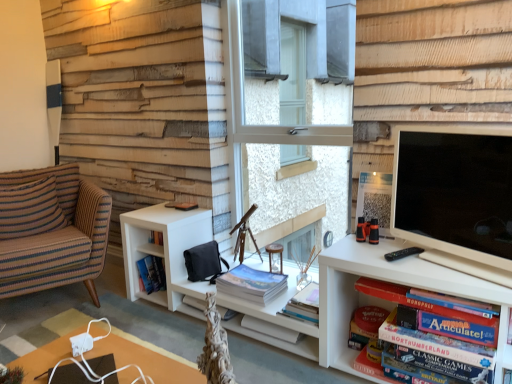
Question: Is striped fabric pillow at left to the right of matte white tv at right from the viewer's perspective?

Choices:
 (A) no
 (B) yes

Answer: (A)

Question: From a real-world perspective, is striped fabric pillow at left below matte white tv at right?

Choices:
 (A) no
 (B) yes

Answer: (B)

Question: Could you tell me if striped fabric pillow at left is turned towards matte white tv at right?

Choices:
 (A) no
 (B) yes

Answer: (B)

Question: Can you confirm if striped fabric pillow at left is taller than matte white tv at right?

Choices:
 (A) yes
 (B) no

Answer: (B)

Question: From the image's perspective, is striped fabric pillow at left located beneath matte white tv at right?

Choices:
 (A) yes
 (B) no

Answer: (A)

Question: Based on their sizes in the image, would you say striped fabric armchair at left is bigger or smaller than matte blue book at center, the 1th book when ordered from left to right?

Choices:
 (A) small
 (B) big

Answer: (B)

Question: Is striped fabric armchair at left situated inside matte blue book at center, positioned as the second book in right-to-left order, or outside?

Choices:
 (A) inside
 (B) outside

Answer: (B)

Question: From a real-world perspective, is striped fabric armchair at left positioned above or below matte blue book at center, positioned as the second book in right-to-left order?

Choices:
 (A) above
 (B) below

Answer: (A)

Question: Is striped fabric armchair at left wider or thinner than matte blue book at center, positioned as the second book in right-to-left order?

Choices:
 (A) wide
 (B) thin

Answer: (A)

Question: Considering the positions of matte board game at lower right, acting as the second book starting from the back, and white paper at center, which ranks as the 2th paperback book in right-to-left order, in the image, is matte board game at lower right, acting as the second book starting from the back, taller or shorter than white paper at center, which ranks as the 2th paperback book in right-to-left order,?

Choices:
 (A) tall
 (B) short

Answer: (A)

Question: In the image, is matte board game at lower right, which ranks as the first book in right-to-left order, positioned in front of or behind white paper at center, placed as the 1th paperback book when sorted from left to right?

Choices:
 (A) front
 (B) behind

Answer: (A)

Question: Is matte board game at lower right, acting as the second book starting from the back, inside or outside of white paper at center, placed as the 1th paperback book when sorted from left to right?

Choices:
 (A) inside
 (B) outside

Answer: (B)

Question: Does point (360, 286) appear closer or farther from the camera than point (259, 319)?

Choices:
 (A) farther
 (B) closer

Answer: (B)

Question: Would you say hardcover book at lower right, the second paperback book when ordered from left to right, is to the left or to the right of striped fabric pillow at left in the picture?

Choices:
 (A) left
 (B) right

Answer: (B)

Question: In the image, is hardcover book at lower right, which is counted as the first paperback book, starting from the right, positioned in front of or behind striped fabric pillow at left?

Choices:
 (A) front
 (B) behind

Answer: (A)